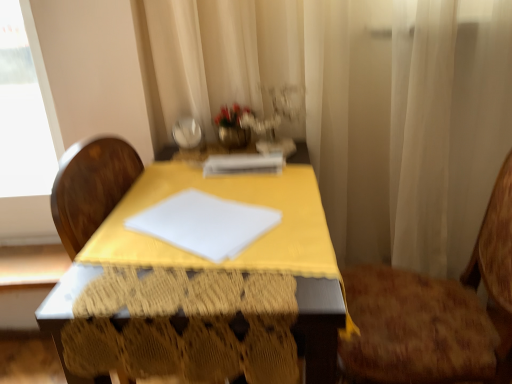
Question: Is white paper at center not near yellow fabric-covered table at center?

Choices:
 (A) yes
 (B) no

Answer: (B)

Question: From a real-world perspective, is white paper at center on top of yellow fabric-covered table at center?

Choices:
 (A) yes
 (B) no

Answer: (A)

Question: Can you confirm if white paper at center is positioned to the left of yellow fabric-covered table at center?

Choices:
 (A) yes
 (B) no

Answer: (B)

Question: From the image's perspective, is white paper at center located beneath yellow fabric-covered table at center?

Choices:
 (A) no
 (B) yes

Answer: (A)

Question: Is white paper at center next to yellow fabric-covered table at center?

Choices:
 (A) no
 (B) yes

Answer: (A)

Question: Does point (316, 311) appear closer or farther from the camera than point (232, 165)?

Choices:
 (A) farther
 (B) closer

Answer: (B)

Question: Looking at the image, does yellow fabric-covered table at center seem bigger or smaller compared to white paper at center?

Choices:
 (A) big
 (B) small

Answer: (A)

Question: Would you say yellow fabric-covered table at center is to the left or to the right of white paper at center in the picture?

Choices:
 (A) right
 (B) left

Answer: (B)

Question: In terms of width, does yellow fabric-covered table at center look wider or thinner when compared to white paper at center?

Choices:
 (A) thin
 (B) wide

Answer: (B)

Question: From a real-world perspective, is brown textured chair at right above or below white paper at center?

Choices:
 (A) below
 (B) above

Answer: (A)

Question: Is brown textured chair at right situated inside white paper at center or outside?

Choices:
 (A) outside
 (B) inside

Answer: (A)

Question: From the image's perspective, is brown textured chair at right positioned above or below white paper at center?

Choices:
 (A) above
 (B) below

Answer: (B)

Question: Considering the positions of brown textured chair at right and white paper at center in the image, is brown textured chair at right wider or thinner than white paper at center?

Choices:
 (A) thin
 (B) wide

Answer: (B)

Question: Do you think white sheer curtain at center is within brown textured chair at right, or outside of it?

Choices:
 (A) inside
 (B) outside

Answer: (B)

Question: In terms of width, does white sheer curtain at center look wider or thinner when compared to brown textured chair at right?

Choices:
 (A) thin
 (B) wide

Answer: (A)